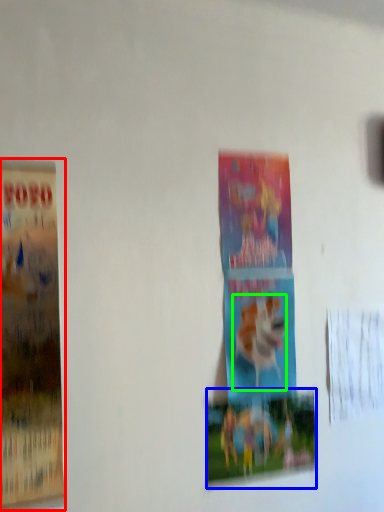
Question: Which is nearer to the poster (highlighted by a red box)? poster (highlighted by a blue box) or animal (highlighted by a green box).

Choices:
 (A) poster
 (B) animal

Answer: (A)